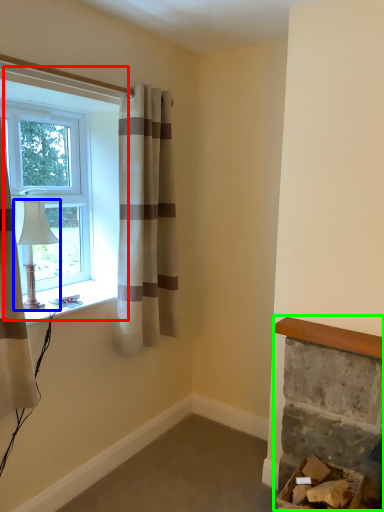
Question: Estimate the real-world distances between objects in this image. Which object is closer to window (highlighted by a red box), lamp (highlighted by a blue box) or fireplace (highlighted by a green box)?

Choices:
 (A) lamp
 (B) fireplace

Answer: (A)